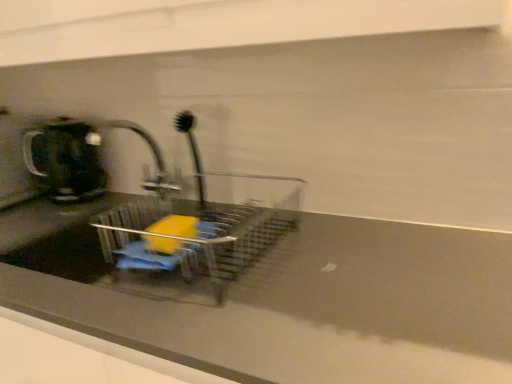
Find the location of `free spot above matte gray counter top at center (from a real-world perspective)`. free spot above matte gray counter top at center (from a real-world perspective) is located at coordinates (239, 264).